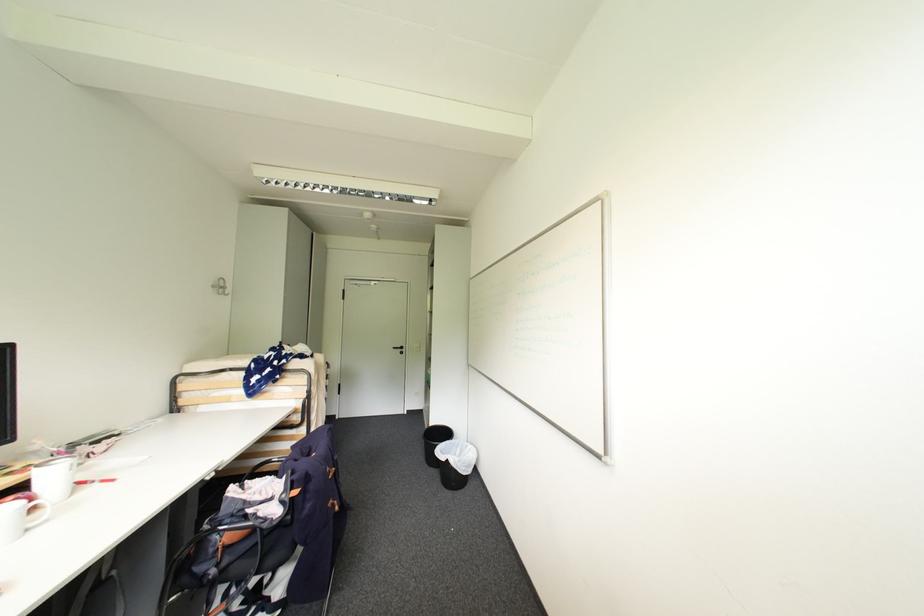
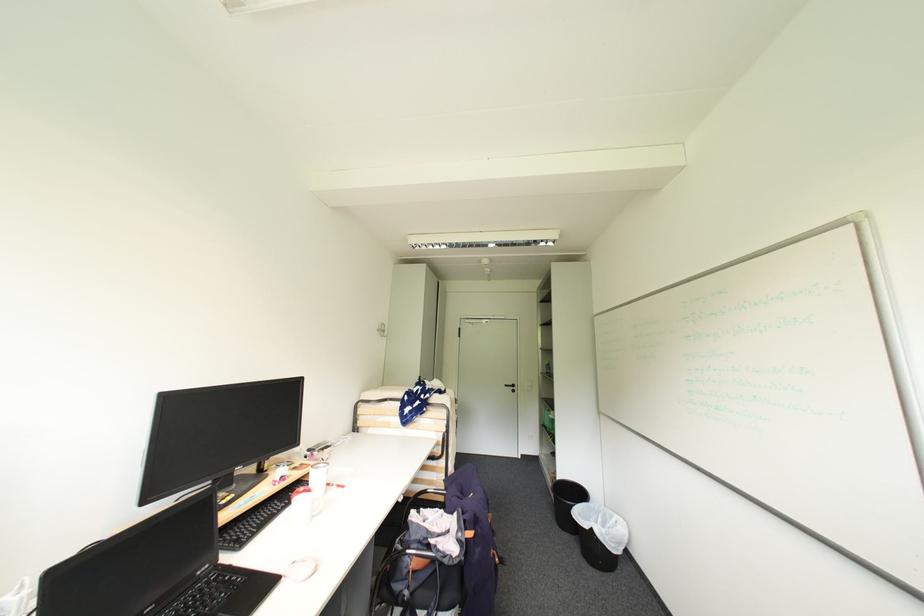
Locate, in the second image, the point that corresponds to [214,479] in the first image.

(407, 501)